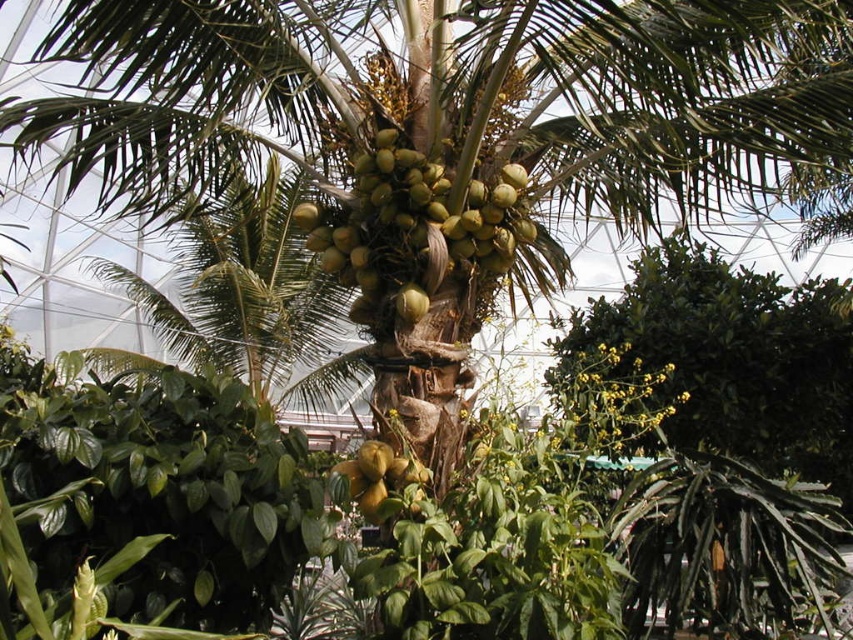
You are a botanist examining the coconut palm tree in the greenhouse. You notice two coconuts labeled as green matte coconuts at center and green matte coconut at center. Which one has a larger width?

The green matte coconuts at center has a larger width than the green matte coconut at center.

You are a botanist examining the coconut palm tree in the tropical setting. You notice a specific point marked at coordinates (415, 227). Which object from the scene is located exactly at this point?

The green matte coconuts at center are located exactly at point (415, 227).